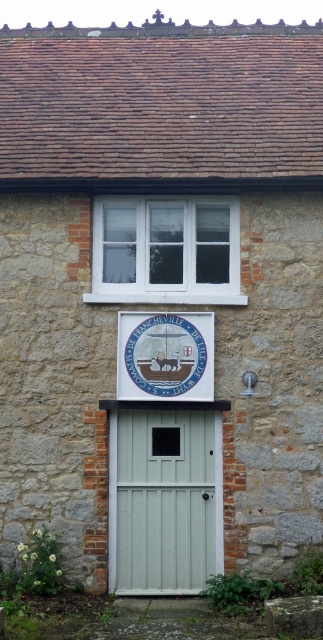
Who is positioned more to the left, white painted wood door at center or white plastic window at upper center?

white plastic window at upper center is more to the left.

Between point (113, 470) and point (208, 216), which one is positioned in front?

Point (113, 470)

This screenshot has height=640, width=323. Find the location of `white painted wood door at center`. white painted wood door at center is located at coordinates (164, 500).

Measure the distance between white plastic window at upper center and matte blue seal at center.

white plastic window at upper center and matte blue seal at center are 25.38 inches apart from each other.

In the scene shown: Does white plastic window at upper center appear on the left side of matte blue seal at center?

Yes, white plastic window at upper center is to the left of matte blue seal at center.

Between point (158, 212) and point (133, 388), which one is positioned in front?

Positioned in front is point (133, 388).

Identify the location of white plastic window at upper center. (166, 250).

Between point (217, 563) and point (189, 371), which one is positioned in front?

Point (189, 371)

Who is positioned more to the right, white painted wood door at center or matte blue seal at center?

From the viewer's perspective, matte blue seal at center appears more on the right side.

Between point (163, 451) and point (129, 330), which one is positioned in front?

Point (129, 330) is in front.

Identify the location of white painted wood door at center. This screenshot has height=640, width=323. (164, 500).